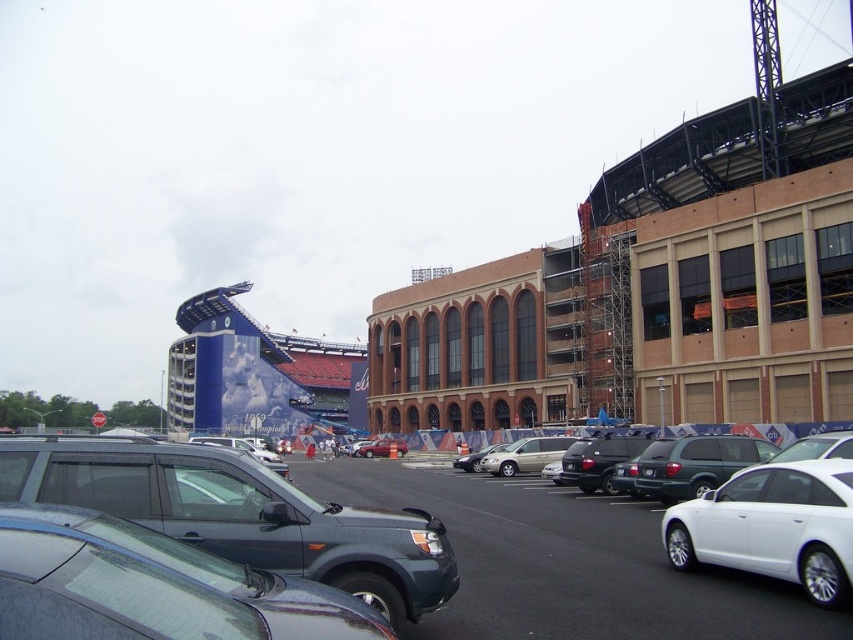
Image resolution: width=853 pixels, height=640 pixels. Describe the element at coordinates (241, 515) in the screenshot. I see `matte gray suv at center` at that location.

Can you confirm if matte gray suv at center is wider than satin silver sedan at center?

Yes.

Is point (399, 579) farther from viewer compared to point (459, 468)?

That is False.

What are the coordinates of `matte gray suv at center` in the screenshot? It's located at (241, 515).

Based on the photo, is the position of matte gray suv at center less distant than that of matte black suv at center?

Yes, matte gray suv at center is closer to the viewer.

Between point (100, 502) and point (386, 438), which one is positioned behind?

Positioned behind is point (386, 438).

Which is in front, point (184, 506) or point (363, 452)?

Positioned in front is point (184, 506).

At what (x,y) coordinates should I click in order to perform the action: click on matte gray suv at center. Please return your answer as a coordinate pair (x, y). This screenshot has height=640, width=853. Looking at the image, I should click on click(241, 515).

Is the position of shiny black sedan at center more distant than that of matte black suv at center?

No, it is not.

Does shiny black sedan at center appear on the left side of matte black suv at center?

No, shiny black sedan at center is not to the left of matte black suv at center.

What do you see at coordinates (598, 460) in the screenshot? I see `shiny black sedan at center` at bounding box center [598, 460].

Where is `shiny black sedan at center`? shiny black sedan at center is located at coordinates (598, 460).